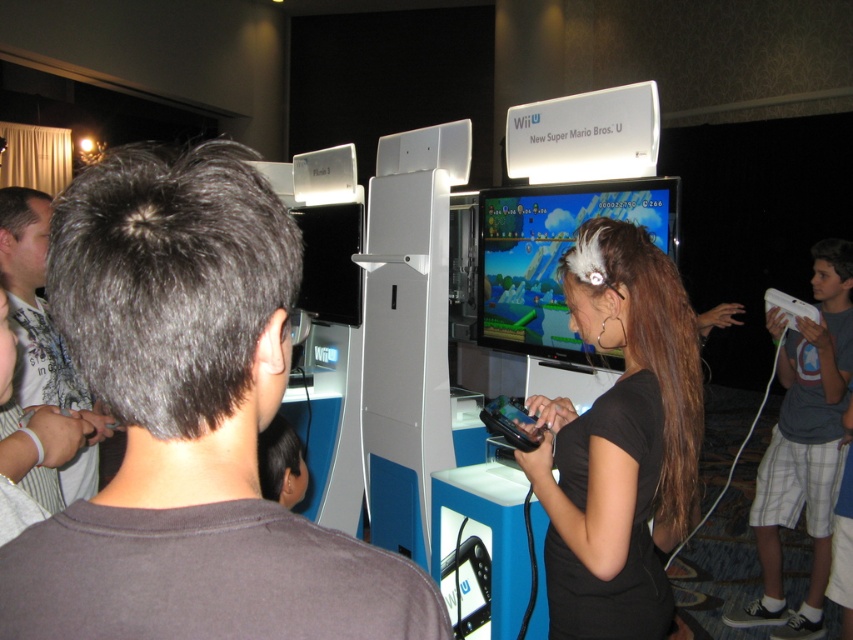
Question: Which point is farther from the camera taking this photo?

Choices:
 (A) (830, 260)
 (B) (550, 474)
 (C) (247, 250)
 (D) (804, 310)

Answer: (A)

Question: Is white matte controller at right to the right of white matte game controller at upper right from the viewer's perspective?

Choices:
 (A) yes
 (B) no

Answer: (B)

Question: Which object appears farthest from the camera in this image?

Choices:
 (A) white matte controller at right
 (B) white matte game controller at upper right

Answer: (B)

Question: Does black matte hair clip at center lie in front of white matte controller at right?

Choices:
 (A) no
 (B) yes

Answer: (B)

Question: Does dark brown hair at center appear on the left side of gray matte hair at upper left?

Choices:
 (A) no
 (B) yes

Answer: (A)

Question: Which of the following is the closest to the observer?

Choices:
 (A) gray matte hair at upper left
 (B) white matte game controller at upper right
 (C) white matte controller at right

Answer: (A)